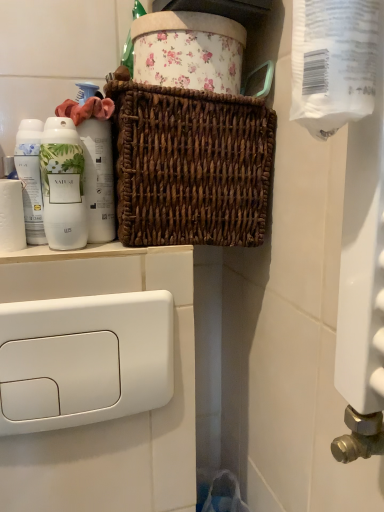
Question: Looking at their shapes, would you say brown woven basket at center is wider or thinner than white matte bottle at left?

Choices:
 (A) wide
 (B) thin

Answer: (A)

Question: Do you think brown woven basket at center is within white matte bottle at left, or outside of it?

Choices:
 (A) outside
 (B) inside

Answer: (A)

Question: Considering the real-world distances, which object is farthest from the brown woven basket at center?

Choices:
 (A) white matte bottle at left
 (B) white matte toilet paper at left, placed as the first toilet paper when sorted from left to right
 (C) transparent plastic toilet paper at upper right, which appears as the 2th toilet paper when viewed from the left
 (D) white glossy bottle at left
 (E) white glossy mouthwash at left

Answer: (C)

Question: Considering the real-world distances, which object is farthest from the white glossy mouthwash at left?

Choices:
 (A) white matte bottle at left
 (B) brown woven basket at center
 (C) white matte toilet paper at left, the 2th toilet paper from the front
 (D) transparent plastic toilet paper at upper right, which appears as the 2th toilet paper when viewed from the left
 (E) white glossy bottle at left

Answer: (D)